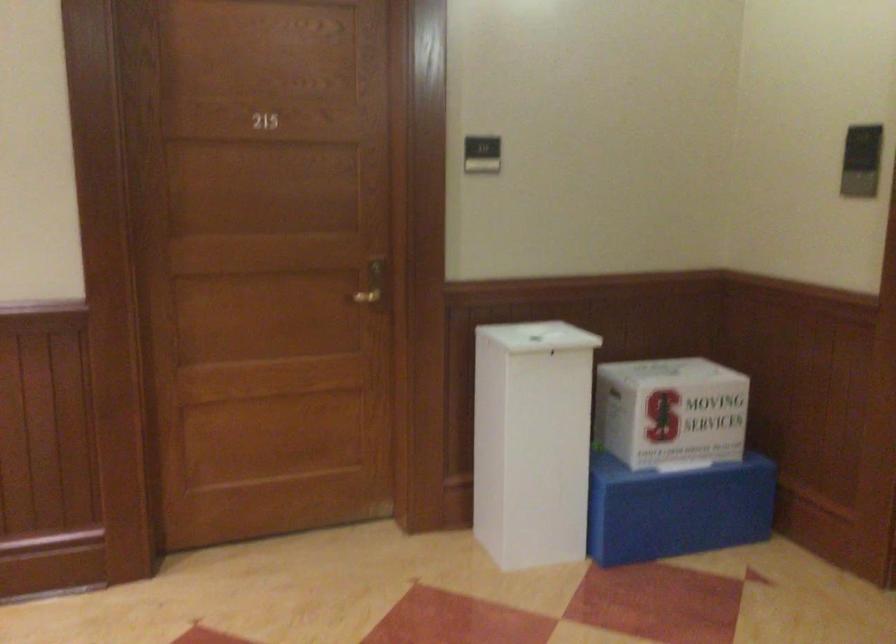
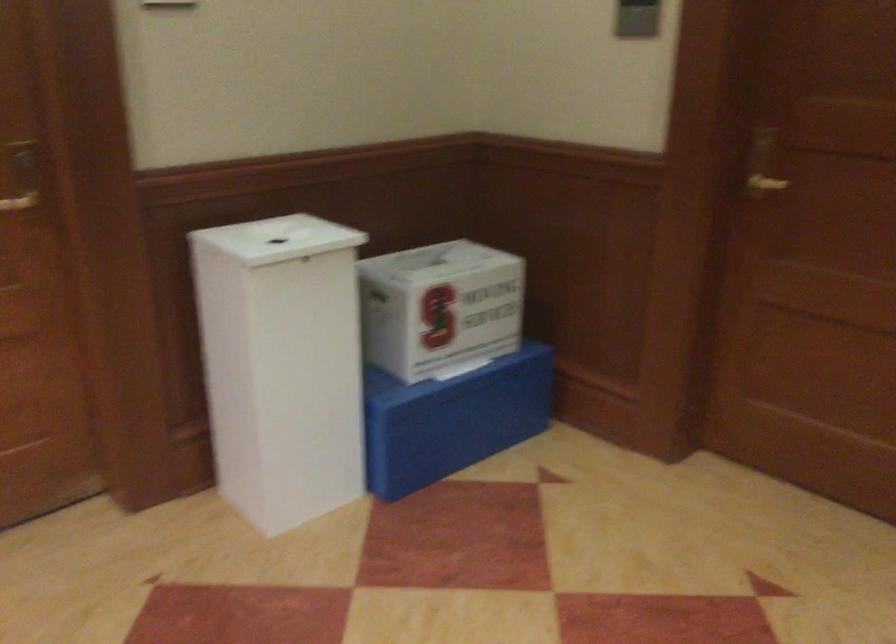
Where in the second image is the point corresponding to point (669, 507) from the first image?

(452, 419)